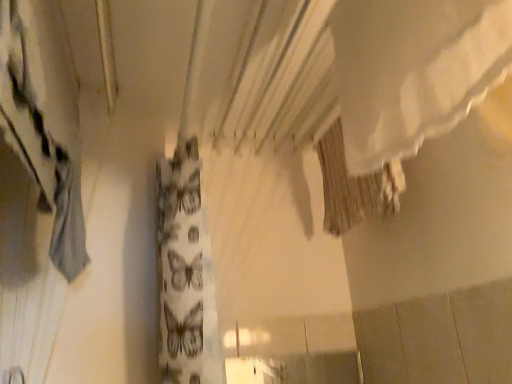
Question: Should I look upward or downward to see brown textured fabric at upper center?

Choices:
 (A) down
 (B) up

Answer: (B)

Question: From a real-world perspective, is brown textured fabric at upper center located beneath gray fabric curtain at left?

Choices:
 (A) yes
 (B) no

Answer: (B)

Question: Is brown textured fabric at upper center at the left side of gray fabric curtain at left?

Choices:
 (A) yes
 (B) no

Answer: (B)

Question: Is brown textured fabric at upper center surrounding gray fabric curtain at left?

Choices:
 (A) yes
 (B) no

Answer: (B)

Question: Is brown textured fabric at upper center thinner than gray fabric curtain at left?

Choices:
 (A) yes
 (B) no

Answer: (A)

Question: Is brown textured fabric at upper center shorter than gray fabric curtain at left?

Choices:
 (A) yes
 (B) no

Answer: (A)

Question: Are brown textured fabric at upper center and gray fabric curtain at left beside each other?

Choices:
 (A) yes
 (B) no

Answer: (B)

Question: Can you confirm if gray fabric curtain at left is bigger than brown textured fabric at upper center?

Choices:
 (A) no
 (B) yes

Answer: (B)

Question: Is gray fabric curtain at left looking in the opposite direction of brown textured fabric at upper center?

Choices:
 (A) yes
 (B) no

Answer: (B)

Question: Can you confirm if gray fabric curtain at left is taller than brown textured fabric at upper center?

Choices:
 (A) yes
 (B) no

Answer: (A)

Question: Is gray fabric curtain at left oriented towards brown textured fabric at upper center?

Choices:
 (A) yes
 (B) no

Answer: (A)

Question: Is gray fabric curtain at left not inside brown textured fabric at upper center?

Choices:
 (A) yes
 (B) no

Answer: (A)

Question: From the image's perspective, is gray fabric curtain at left located above brown textured fabric at upper center?

Choices:
 (A) no
 (B) yes

Answer: (B)

Question: Considering the positions of gray fabric curtain at left and brown textured fabric at upper center in the image, is gray fabric curtain at left bigger or smaller than brown textured fabric at upper center?

Choices:
 (A) big
 (B) small

Answer: (A)